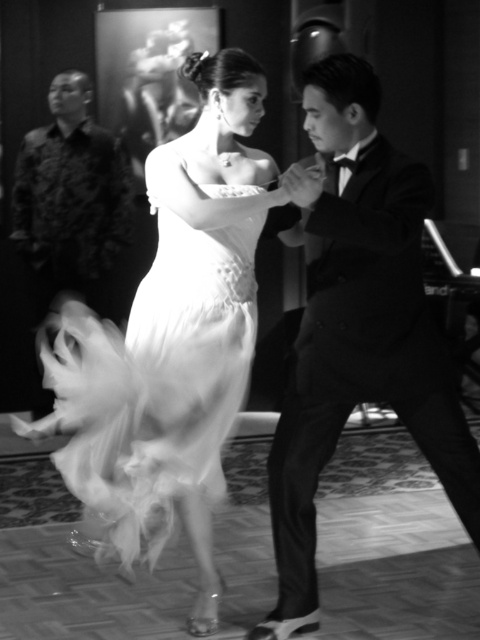
Question: Which of the following is the closest to the observer?

Choices:
 (A) (298, 484)
 (B) (99, 292)

Answer: (A)

Question: Can you confirm if satin dress at center is bigger than patterned fabric shirt at left?

Choices:
 (A) yes
 (B) no

Answer: (A)

Question: Among these objects, which one is farthest from the camera?

Choices:
 (A) shiny black suit at center
 (B) satin dress at center
 (C) patterned fabric shirt at left

Answer: (C)

Question: In this image, where is satin dress at center located relative to patterned fabric shirt at left?

Choices:
 (A) above
 (B) below

Answer: (B)

Question: Which is farther from the patterned fabric shirt at left?

Choices:
 (A) shiny black suit at center
 (B) satin dress at center

Answer: (A)

Question: Can you confirm if satin dress at center is bigger than shiny black suit at center?

Choices:
 (A) yes
 (B) no

Answer: (A)